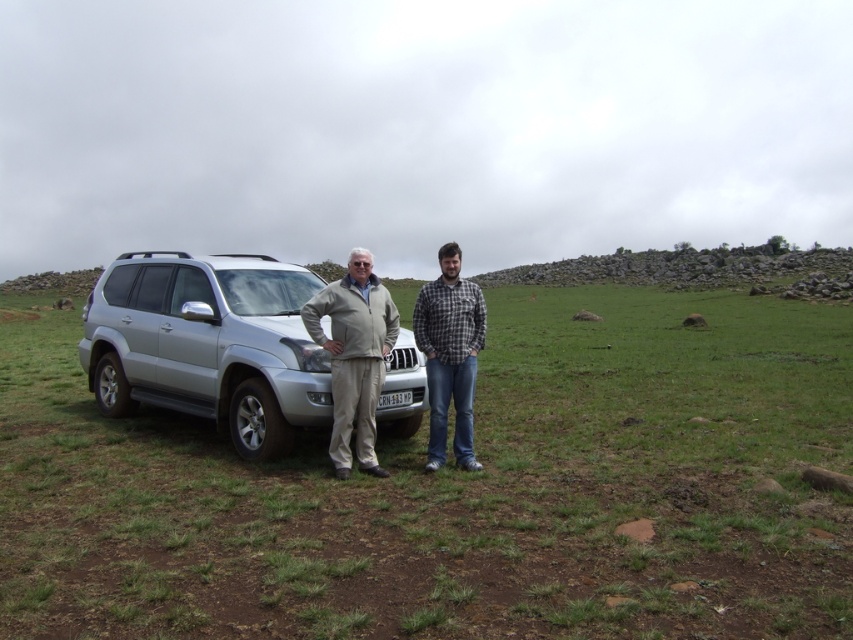
Can you confirm if silver metallic suv at center is positioned to the right of light gray fabric jacket at center?

In fact, silver metallic suv at center is to the left of light gray fabric jacket at center.

Between silver metallic suv at center and light gray fabric jacket at center, which one is positioned higher?

silver metallic suv at center is above.

Is point (329, 362) in front of point (332, 392)?

No, (329, 362) is further to viewer.

Where is `silver metallic suv at center`? Image resolution: width=853 pixels, height=640 pixels. silver metallic suv at center is located at coordinates (207, 344).

Does silver metallic suv at center have a greater height compared to plaid flannel shirt at center?

Yes.

Can you confirm if silver metallic suv at center is positioned to the right of plaid flannel shirt at center?

No, silver metallic suv at center is not to the right of plaid flannel shirt at center.

Locate an element on the screen. silver metallic suv at center is located at coordinates (207, 344).

Is green grassy field at center positioned behind silver metallic suv at center?

No.

Does green grassy field at center have a larger size compared to silver metallic suv at center?

Yes, green grassy field at center is bigger than silver metallic suv at center.

The width and height of the screenshot is (853, 640). I want to click on green grassy field at center, so click(457, 490).